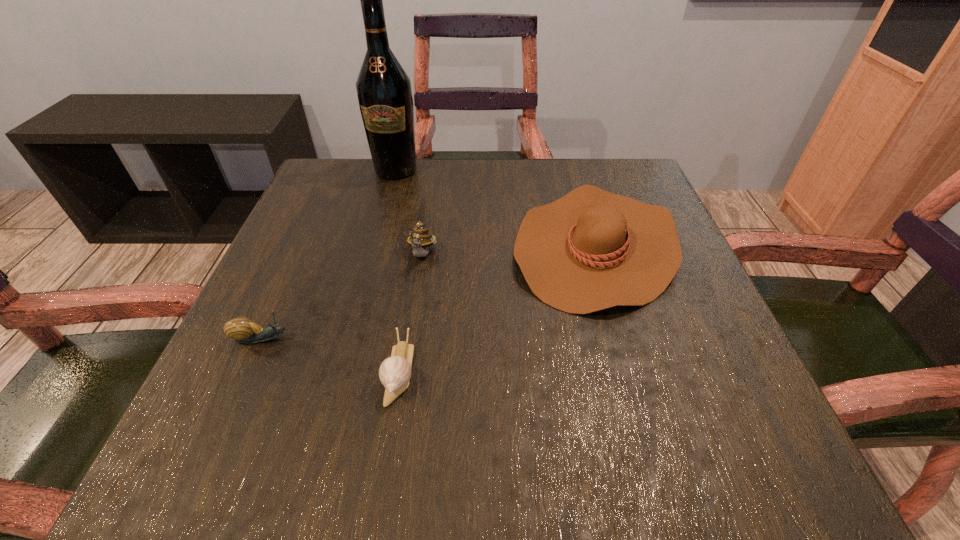
This screenshot has width=960, height=540. What are the coordinates of `vacant area situated 0.400m on the front-facing side of the leftmost object` in the screenshot? It's located at (539, 339).

Locate an element on the screen. The height and width of the screenshot is (540, 960). wine bottle present at the far edge is located at coordinates (384, 92).

Identify the location of cowboy hat at the far edge. (590, 250).

Locate an element on the screen. This screenshot has height=540, width=960. wine bottle located in the left edge section of the desktop is located at coordinates (384, 92).

Locate an element on the screen. Image resolution: width=960 pixels, height=540 pixels. escargot that is at the left edge is located at coordinates (243, 330).

Locate an element on the screen. object at the right edge is located at coordinates (590, 250).

Locate an element on the screen. object located in the far left corner section of the desktop is located at coordinates (384, 92).

Locate an element on the screen. object located at the far right corner is located at coordinates (590, 250).

In the image, there is a desktop. Identify the location of vacant space at the far edge. The height and width of the screenshot is (540, 960). (447, 201).

The image size is (960, 540). In order to click on vacant space at the near edge of the desktop in this screenshot , I will do `click(328, 433)`.